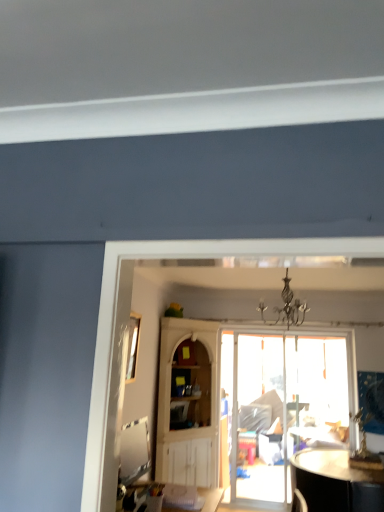
Question: Does translucent glass door at center have a smaller size compared to white wood cabinet at center?

Choices:
 (A) yes
 (B) no

Answer: (A)

Question: Is translucent glass door at center touching white wood cabinet at center?

Choices:
 (A) no
 (B) yes

Answer: (A)

Question: Is translucent glass door at center further to camera compared to white wood cabinet at center?

Choices:
 (A) yes
 (B) no

Answer: (A)

Question: Would you say translucent glass door at center is a long distance from white wood cabinet at center?

Choices:
 (A) yes
 (B) no

Answer: (B)

Question: Can we say translucent glass door at center lies outside white wood cabinet at center?

Choices:
 (A) yes
 (B) no

Answer: (A)

Question: Is translucent glass door at center positioned with its back to white wood cabinet at center?

Choices:
 (A) yes
 (B) no

Answer: (B)

Question: Is black wrought iron chandelier at center directly adjacent to clear glass window at upper left?

Choices:
 (A) no
 (B) yes

Answer: (A)

Question: Is black wrought iron chandelier at center taller than clear glass window at upper left?

Choices:
 (A) no
 (B) yes

Answer: (A)

Question: From a real-world perspective, is black wrought iron chandelier at center positioned over clear glass window at upper left based on gravity?

Choices:
 (A) no
 (B) yes

Answer: (B)

Question: Is clear glass window at upper left a part of black wrought iron chandelier at center?

Choices:
 (A) no
 (B) yes

Answer: (A)

Question: Is black wrought iron chandelier at center closer to the viewer compared to clear glass window at upper left?

Choices:
 (A) yes
 (B) no

Answer: (A)

Question: Considering the relative sizes of black wrought iron chandelier at center and clear glass window at upper left in the image provided, is black wrought iron chandelier at center wider than clear glass window at upper left?

Choices:
 (A) no
 (B) yes

Answer: (B)

Question: Does white wood cabinet at center come behind translucent glass door at center?

Choices:
 (A) no
 (B) yes

Answer: (A)